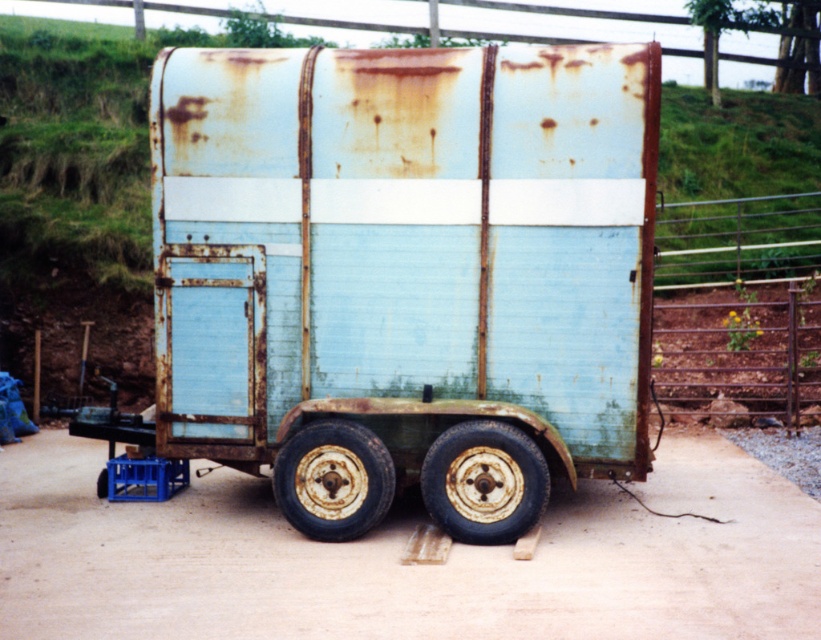
Question: Which object is closer to the camera taking this photo?

Choices:
 (A) brown dirt track at center
 (B) rusty metal trailer at center
 (C) rusty metal wheel at center

Answer: (A)

Question: Does rusty metal trailer at center appear over brown dirt track at center?

Choices:
 (A) no
 (B) yes

Answer: (B)

Question: Observing the image, what is the correct spatial positioning of rusty metal trailer at center in reference to brown dirt track at center?

Choices:
 (A) right
 (B) left

Answer: (A)

Question: Among these objects, which one is nearest to the camera?

Choices:
 (A) brown dirt track at center
 (B) rusty metal trailer at center
 (C) rusty metal fence at right

Answer: (A)

Question: In this image, where is rusty metal trailer at center located relative to rusty metal wheel at lower center?

Choices:
 (A) right
 (B) left

Answer: (A)

Question: Which point appears closest to the camera in this image?

Choices:
 (A) (287, 493)
 (B) (33, 545)
 (C) (755, 321)

Answer: (B)